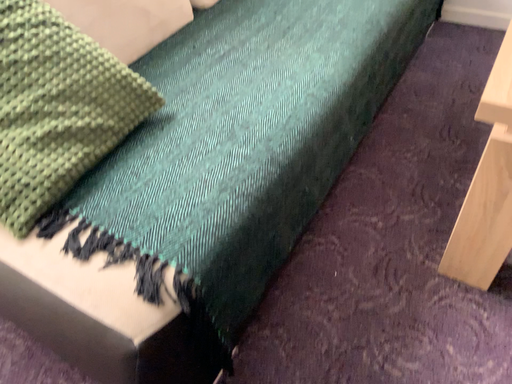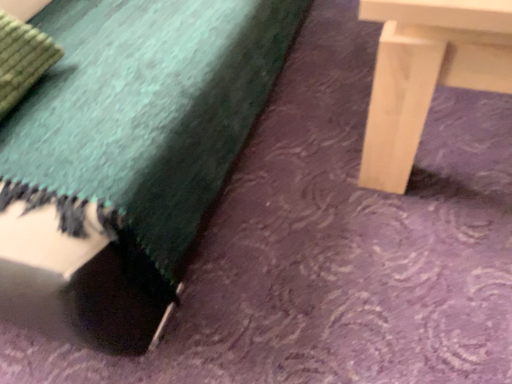
Question: How did the camera likely rotate when shooting the video?

Choices:
 (A) rotated left
 (B) rotated right

Answer: (B)